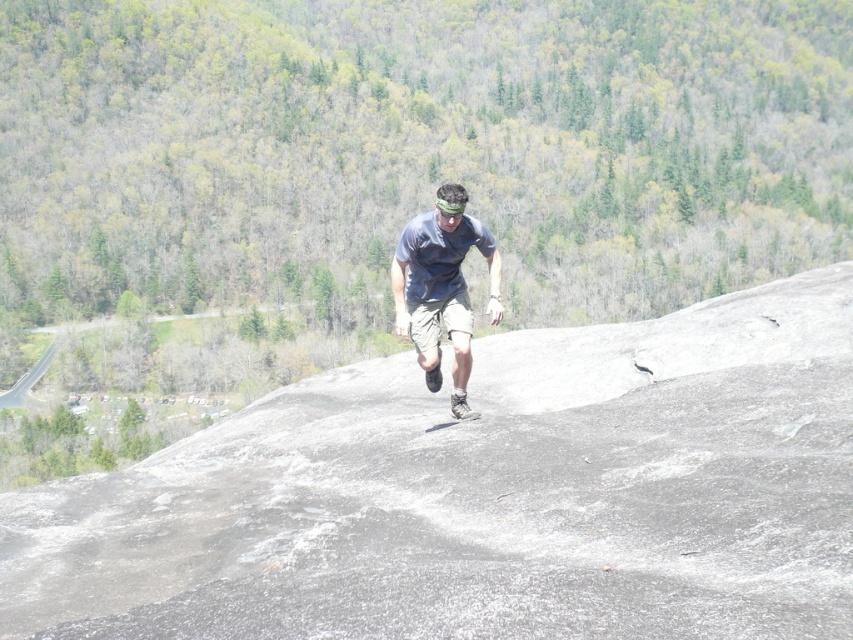
You are a photographer positioned at the base of the rock face. You want to capture a photo of the matte blue shirt at center and the gray rock at center in the same frame. Which object should you focus on first to ensure both are in the frame?

The gray rock at center is shorter than the matte blue shirt at center, so you should focus on the matte blue shirt at center first to ensure both are in the frame.